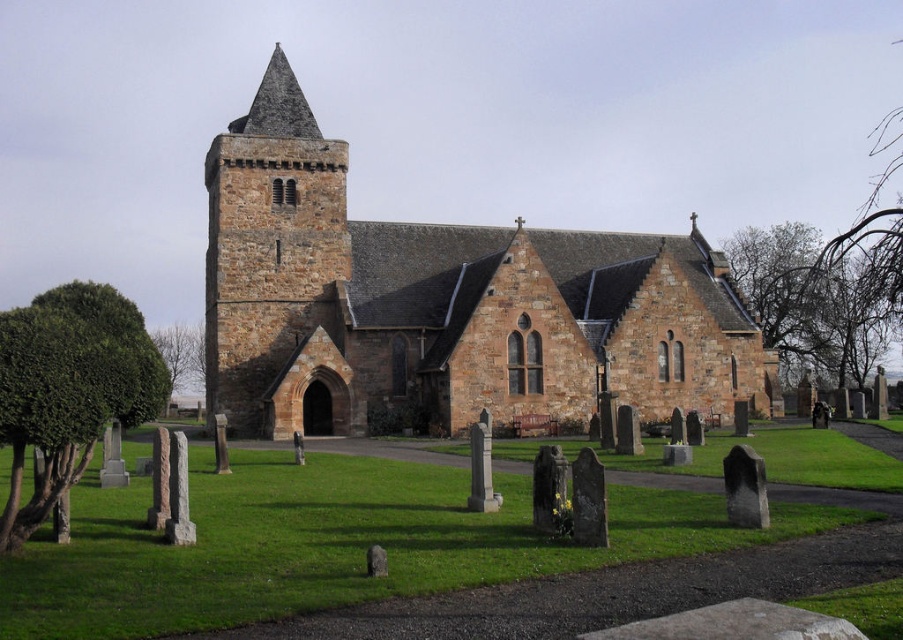
You are standing in front of the church and want to take a photo that includes both point (287, 429) and point (177, 330). Since you want the closer point to be in focus, which point should you focus on?

Point (287, 429) is closer to the camera than point (177, 330), so you should focus on point (287, 429) to ensure it is in focus.

You are standing at the entrance of the traditional stone church and notice the bare branches at upper right. Based on their position, can you determine if they are closer to the church or the graveyard?

The bare branches at upper right are located at point coordinates that place them closer to the church rather than the graveyard.